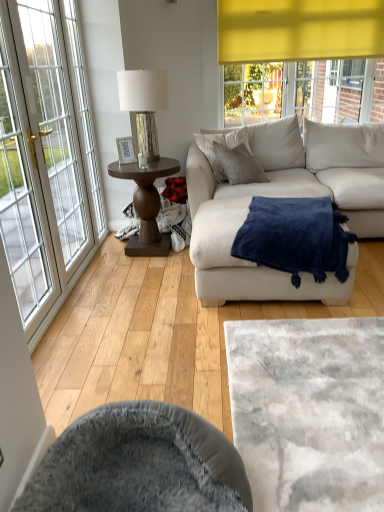
In order to click on vacant space to the left of velvety gray cat bed at lower center in this screenshot , I will do `click(145, 356)`.